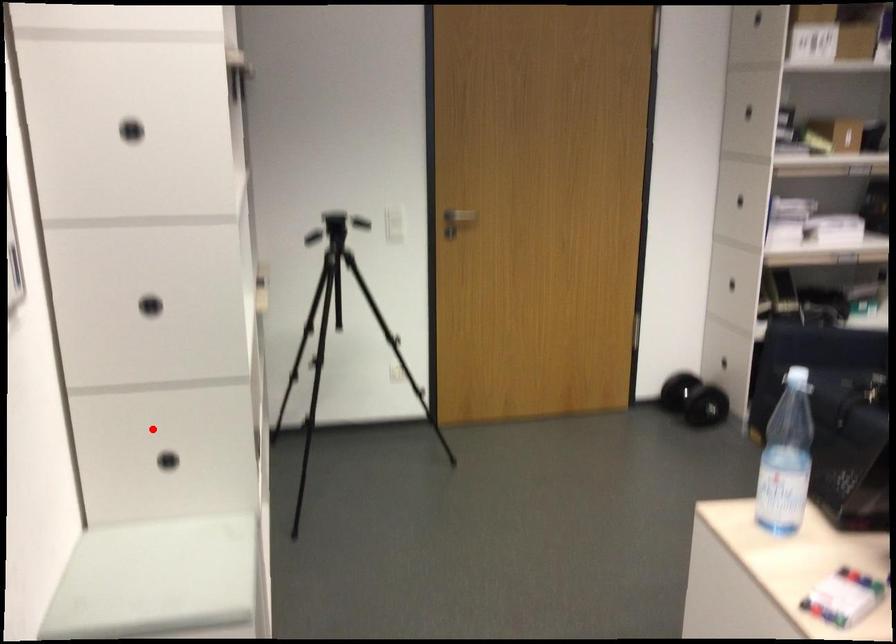
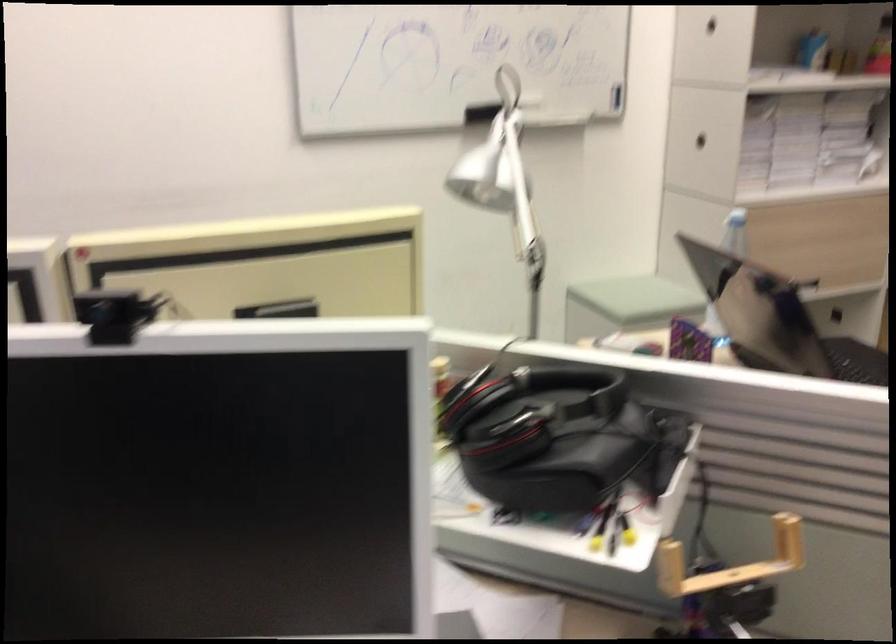
Locate, in the second image, the point that corresponds to the highlighted location in the first image.

(735, 232)